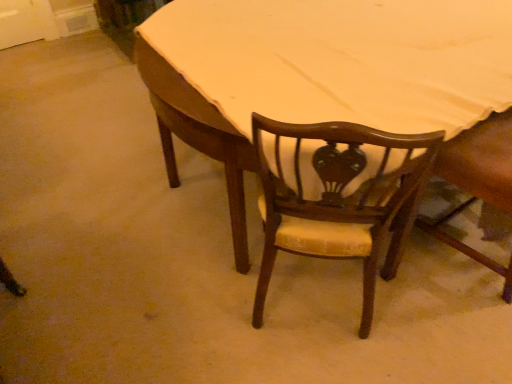
Question: Should I look upward or downward to see wooden chair at center, which is the second chair from right to left?

Choices:
 (A) up
 (B) down

Answer: (B)

Question: Is wooden chair at center, marked as the 2th chair in a left-to-right arrangement, turned away from wooden table at center?

Choices:
 (A) yes
 (B) no

Answer: (A)

Question: Is wooden chair at center, marked as the 2th chair in a left-to-right arrangement, facing towards wooden table at center?

Choices:
 (A) no
 (B) yes

Answer: (B)

Question: Considering the relative sizes of wooden chair at center, the first chair viewed from the right, and wooden table at center in the image provided, is wooden chair at center, the first chair viewed from the right, smaller than wooden table at center?

Choices:
 (A) yes
 (B) no

Answer: (A)

Question: Is wooden chair at center, the first chair viewed from the right, located outside wooden table at center?

Choices:
 (A) no
 (B) yes

Answer: (A)

Question: From the image's perspective, is wooden chair at center, the first chair viewed from the right, located beneath wooden table at center?

Choices:
 (A) no
 (B) yes

Answer: (B)

Question: Can you confirm if wooden chair at center, the first chair viewed from the right, is thinner than wooden table at center?

Choices:
 (A) yes
 (B) no

Answer: (A)

Question: Can you confirm if wooden chair at center, positioned as the 1th chair in left-to-right order, is taller than wooden table at center?

Choices:
 (A) no
 (B) yes

Answer: (B)

Question: Is wooden chair at center, positioned as the 1th chair in left-to-right order, shorter than wooden table at center?

Choices:
 (A) no
 (B) yes

Answer: (A)

Question: Is wooden chair at center, which is the second chair from right to left, positioned far away from wooden table at center?

Choices:
 (A) yes
 (B) no

Answer: (B)

Question: Is wooden chair at center, positioned as the 1th chair in left-to-right order, positioned in front of wooden table at center?

Choices:
 (A) no
 (B) yes

Answer: (B)

Question: From a real-world perspective, does wooden chair at center, positioned as the 1th chair in left-to-right order, sit lower than wooden table at center?

Choices:
 (A) no
 (B) yes

Answer: (A)

Question: Is wooden chair at center, positioned as the 1th chair in left-to-right order, located outside wooden table at center?

Choices:
 (A) no
 (B) yes

Answer: (A)

Question: Can you confirm if wooden table at center is positioned to the right of wooden chair at center, the first chair viewed from the right?

Choices:
 (A) yes
 (B) no

Answer: (B)